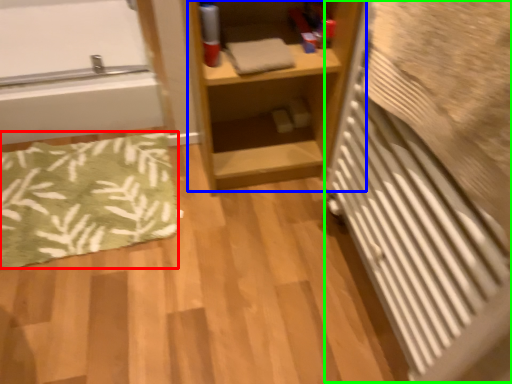
Question: Based on their relative distances, which object is nearer to bath mat (highlighted by a red box)? Choose from shelf (highlighted by a blue box) and radiator (highlighted by a green box).

Choices:
 (A) shelf
 (B) radiator

Answer: (A)